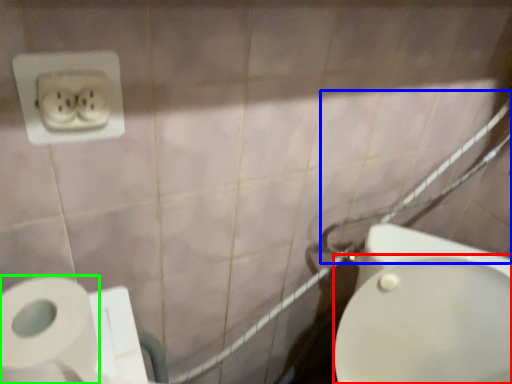
Question: Based on their relative distances, which object is nearer to bidet (highlighted by a red box)? Choose from shower (highlighted by a blue box) and toilet paper (highlighted by a green box).

Choices:
 (A) shower
 (B) toilet paper

Answer: (A)